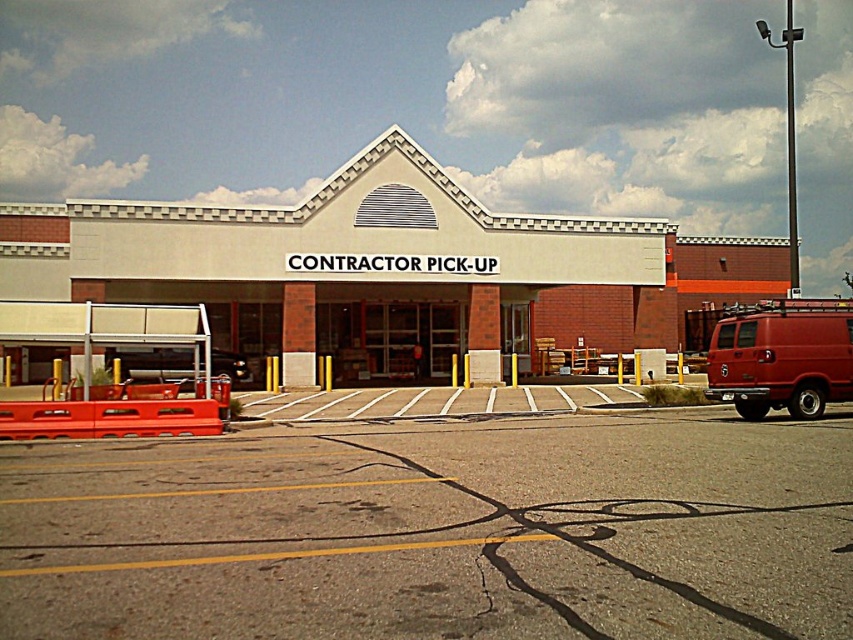
You are a contractor arriving at the Contractor Pick Up zone. You need to park your metallic silver car at lower left. Is there enough space in the gray asphalt parking lot at center to accommodate your car?

The gray asphalt parking lot at center has a larger size compared to metallic silver car at lower left, so yes, there is enough space to accommodate the metallic silver car at lower left.

You are a contractor arriving at the Contractor Pick Up zone. You see a matte red van at right and a metallic silver car at lower left. Which vehicle is wider?

The matte red van at right is wider than the metallic silver car at lower left.

You are a contractor arriving at the Contractor Pick Up zone. You see a point marked at coordinates (781, 356). What object is located at that point?

The point at coordinates (781, 356) indicates a matte red van at right.